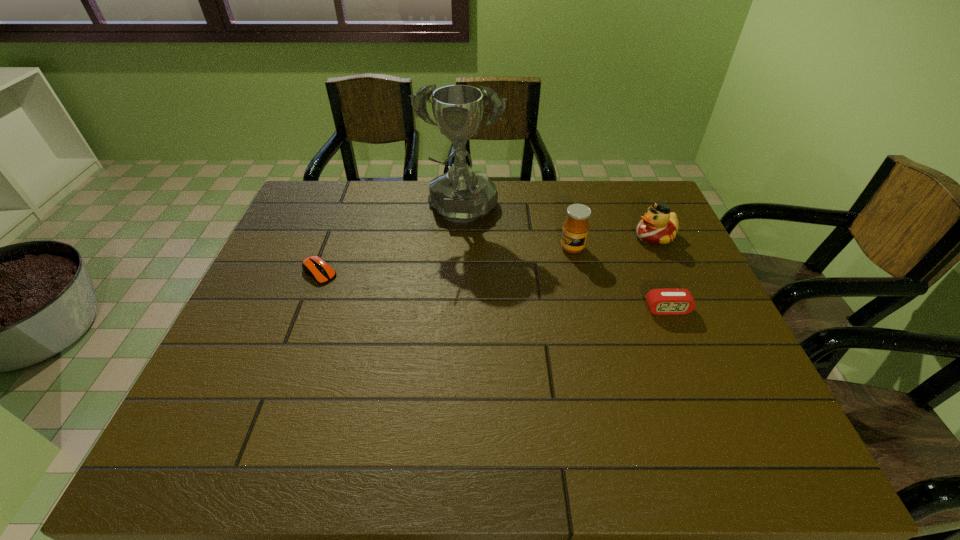
Identify the location of vacant space on the desktop that is between the second nearest object and the nearest object and is positioned on the front-facing side of the third object from right to left. This screenshot has width=960, height=540. (493, 291).

The width and height of the screenshot is (960, 540). I want to click on vacant space on the desktop that is between the shortest object and the alarm clock and is positioned on the side with emblem of the award, so click(x=446, y=286).

Where is `free space on the desktop that is between the computer mouse and the nearest object and is positioned on the face of the duck`? This screenshot has width=960, height=540. free space on the desktop that is between the computer mouse and the nearest object and is positioned on the face of the duck is located at coordinates (499, 292).